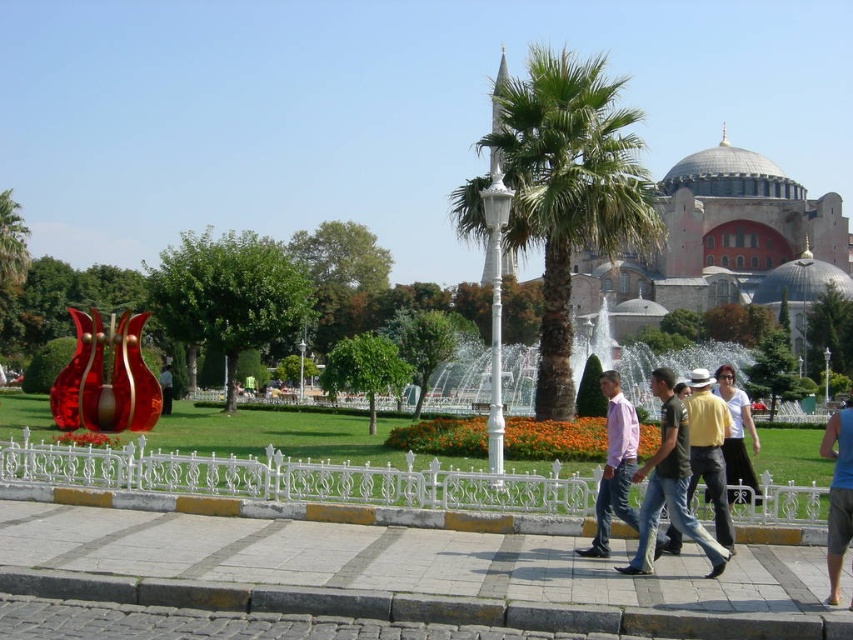
You are standing on the cobblestone pavement at the bottom left corner of the plaza and want to reach the historical building in the background. There are two landmarks visible in your path. The first is the metallic red sculpture at left, and the second is the yellow cotton shirt at center. Which landmark should you head towards first to stay on the correct path?

You should head towards the metallic red sculpture at left first because the yellow cotton shirt at center is to the right of it, so the metallic red sculpture at left is closer to your starting point on the cobblestone pavement at the bottom left corner.

You are a photographer trying to capture a candid shot of the pink cotton shirt at center and the blue fabric shorts at lower right. Based on their positions and sizes, which object would appear larger in your photo?

The pink cotton shirt at center would appear larger in the photo since it has a greater height compared to the blue fabric shorts at lower right.